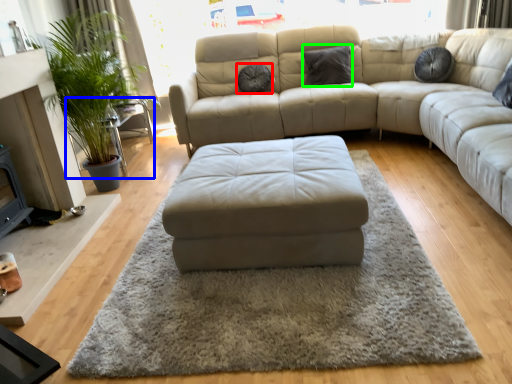
Question: Which object is the farthest from pillow (highlighted by a red box)? Choose among these: side table (highlighted by a blue box) or pillow (highlighted by a green box).

Choices:
 (A) side table
 (B) pillow

Answer: (A)